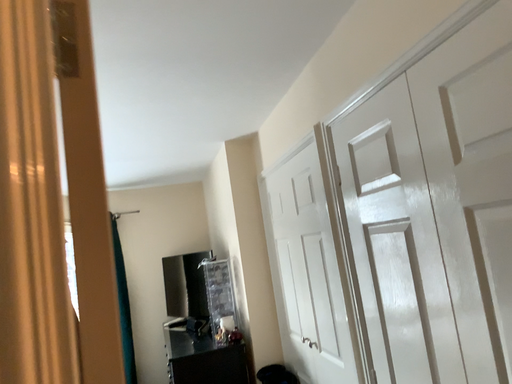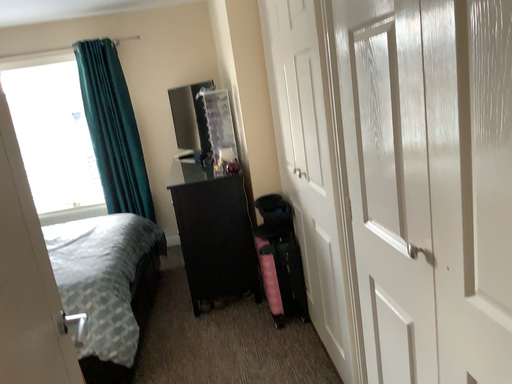
Question: Which way did the camera rotate in the video?

Choices:
 (A) rotated upward
 (B) rotated downward

Answer: (B)